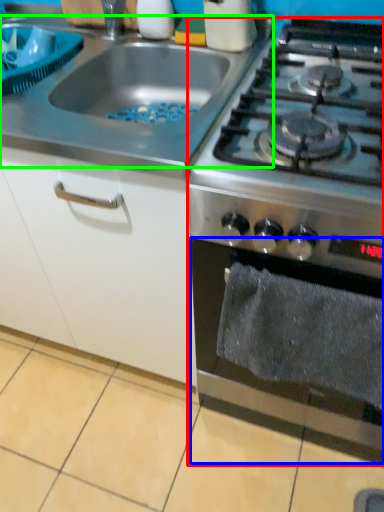
Question: Which is farther away from gas stove (highlighted by a red box)? oven (highlighted by a blue box) or gas stove (highlighted by a green box)?

Choices:
 (A) oven
 (B) gas stove

Answer: (B)